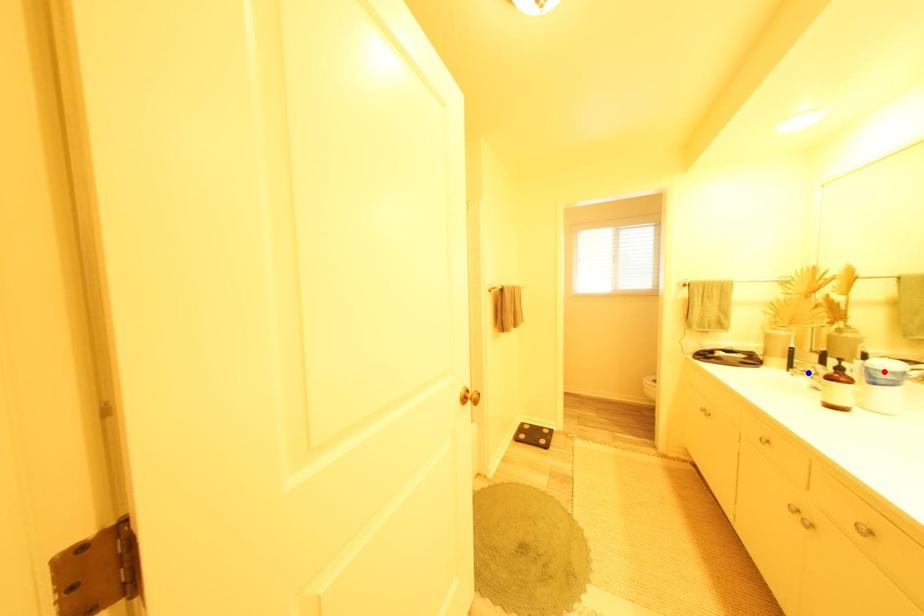
Question: In the image, two points are highlighted. Which point is nearer to the camera? Reply with the corresponding letter.

Choices:
 (A) blue point
 (B) red point

Answer: (B)